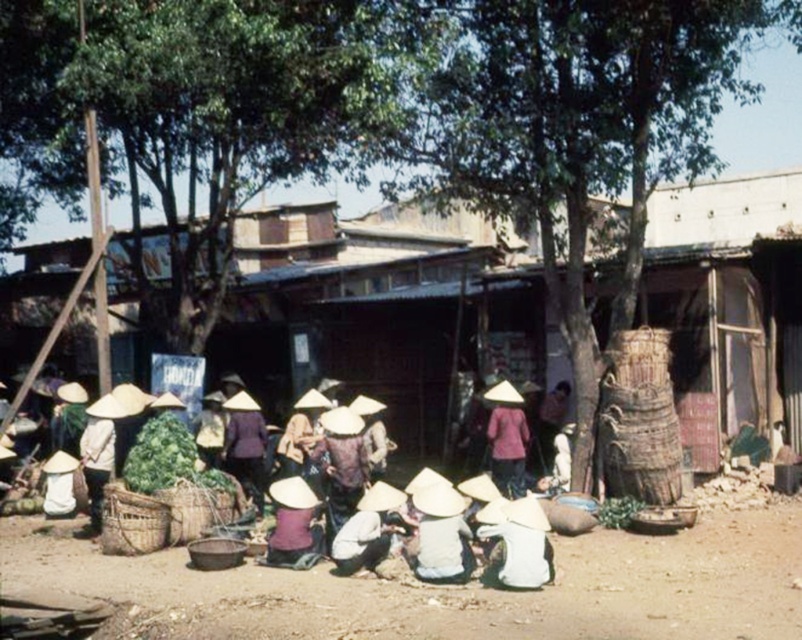
In the rural market scene, you see a white straw hat at lower center and a purple fabric hat at center. Which hat is positioned to the right of the other?

The white straw hat at lower center is to the right of the purple fabric hat at center.